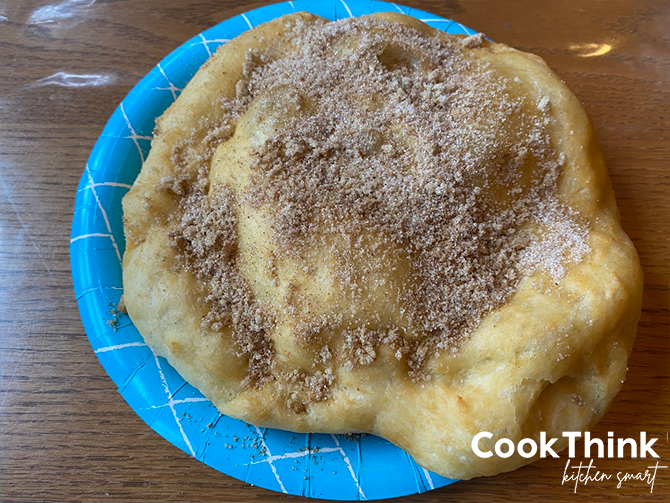
Identify the location of paper plate. Image resolution: width=670 pixels, height=503 pixels. (x=291, y=465).